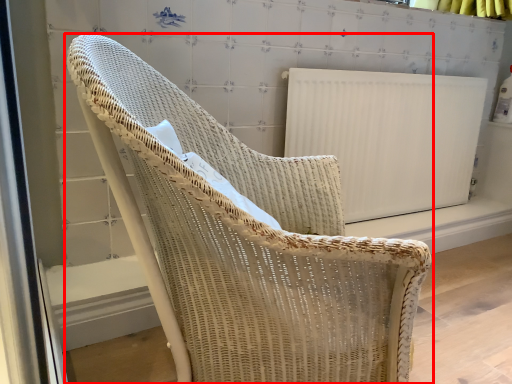
Question: From the image's perspective, considering the relative positions of chair (annotated by the red box) and radiator in the image provided, where is chair (annotated by the red box) located with respect to the staircase?

Choices:
 (A) above
 (B) below

Answer: (B)